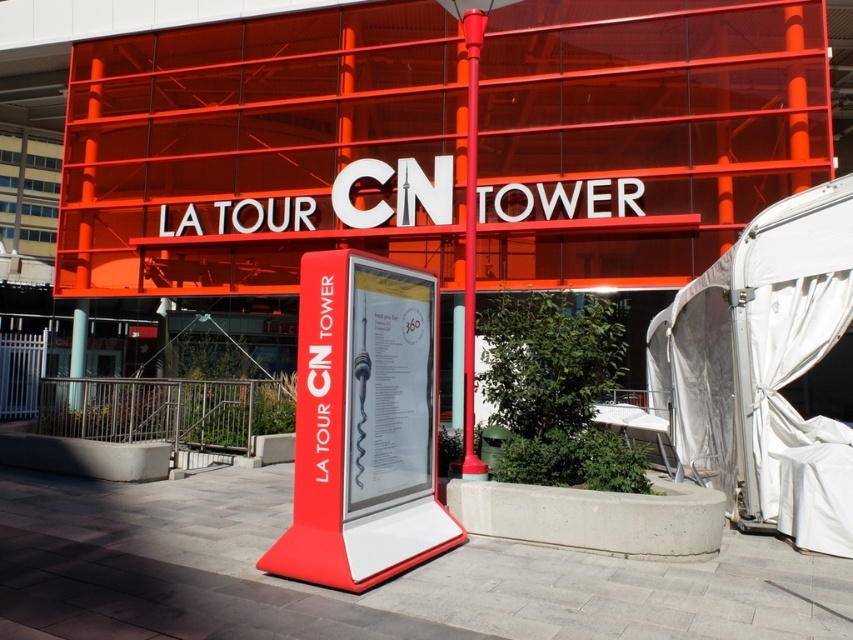
Question: From the image, what is the correct spatial relationship of white fabric tent at right in relation to matte red sign at center?

Choices:
 (A) left
 (B) right

Answer: (B)

Question: In this image, where is white fabric tent at right located relative to shiny red pole at center?

Choices:
 (A) above
 (B) below

Answer: (B)

Question: Which object appears farthest from the camera in this image?

Choices:
 (A) shiny red pole at center
 (B) matte red sign at center
 (C) white fabric tent at right

Answer: (A)

Question: Is white fabric tent at right below matte red sign at center?

Choices:
 (A) no
 (B) yes

Answer: (B)

Question: Which of these objects is positioned closest to the shiny red pole at center?

Choices:
 (A) matte red sign at center
 (B) white fabric tent at right

Answer: (A)

Question: Which object is closer to the camera taking this photo?

Choices:
 (A) shiny red pole at center
 (B) matte red sign at center
 (C) white fabric tent at right

Answer: (B)